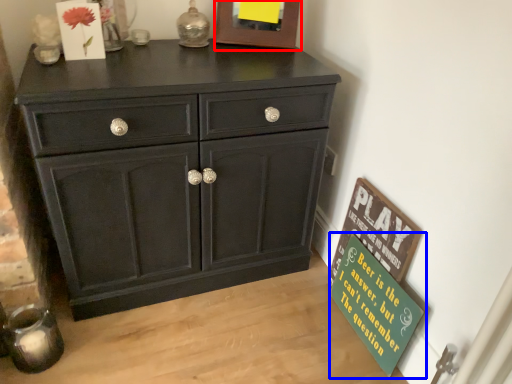
Question: Among these objects, which one is nearest to the camera, picture frame (highlighted by a red box) or bulletin board (highlighted by a blue box)?

Choices:
 (A) picture frame
 (B) bulletin board

Answer: (B)